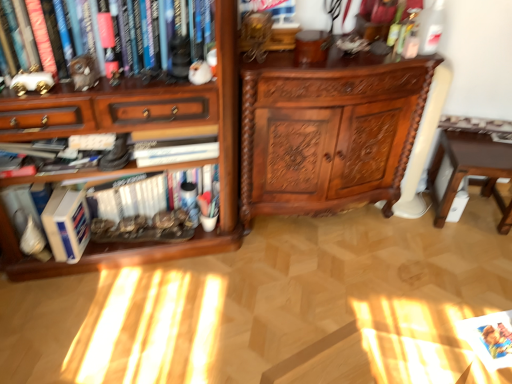
Image resolution: width=512 pixels, height=384 pixels. Find the location of `free space above polished wood cabinet at center (from a real-world perspective)`. free space above polished wood cabinet at center (from a real-world perspective) is located at coordinates (348, 56).